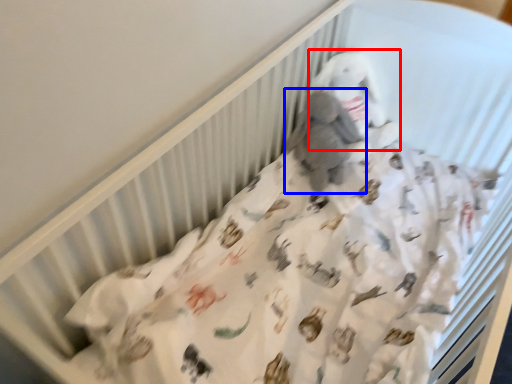
Question: Among these objects, which one is farthest to the camera, toy (highlighted by a red box) or baby elephant (highlighted by a blue box)?

Choices:
 (A) toy
 (B) baby elephant

Answer: (A)